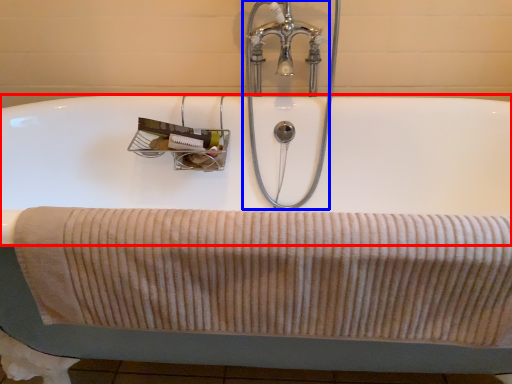
Question: Which of the following is the farthest to the observer, bath (highlighted by a red box) or tap (highlighted by a blue box)?

Choices:
 (A) bath
 (B) tap

Answer: (B)